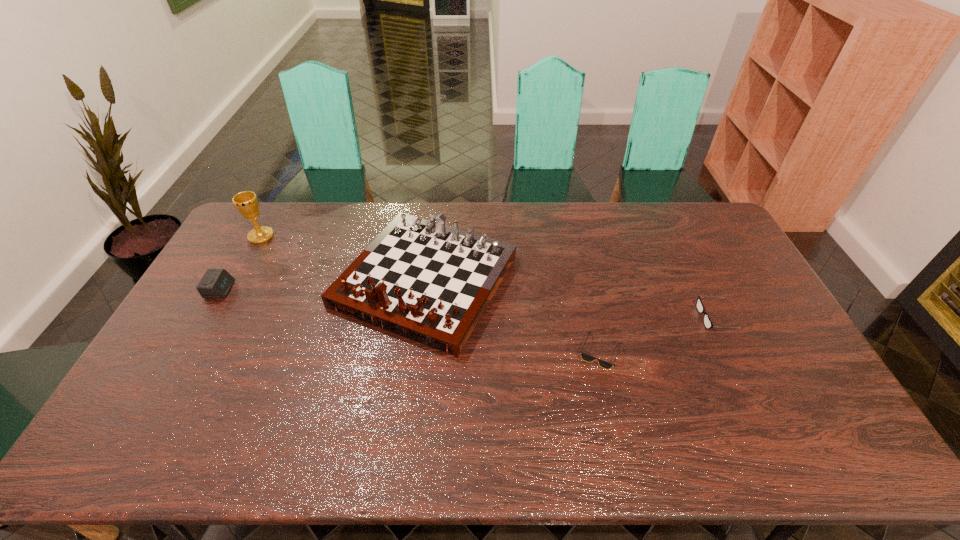
The height and width of the screenshot is (540, 960). Identify the location of chalice. (246, 202).

Where is `the third object from right to left`? the third object from right to left is located at coordinates 420,279.

Locate an element on the screen. This screenshot has width=960, height=540. gameboard is located at coordinates (420, 279).

The width and height of the screenshot is (960, 540). Identify the location of the third shortest object. (216, 283).

At what (x,y) coordinates should I click in order to perform the action: click on the rightmost object. Please return your answer as a coordinate pair (x, y). Looking at the image, I should click on (708, 324).

You are a GUI agent. You are given a task and a screenshot of the screen. Output one action in this format:
    pyautogui.click(x=<x>, y=<y>)
    Task: Click on the fourth object from left to right
    This screenshot has height=540, width=960.
    Given the screenshot: What is the action you would take?
    pyautogui.click(x=588, y=358)

Find the location of a particular element. sunglasses is located at coordinates (588, 358).

In order to click on free space located 0.160m on the right of the chalice in this screenshot , I will do `click(317, 236)`.

Locate an element on the screen. This screenshot has height=540, width=960. vacant space located 0.340m on the left of the fourth shortest object is located at coordinates (231, 281).

Find the location of `free space located on the front-facing side of the third shortest object`. free space located on the front-facing side of the third shortest object is located at coordinates (x=326, y=289).